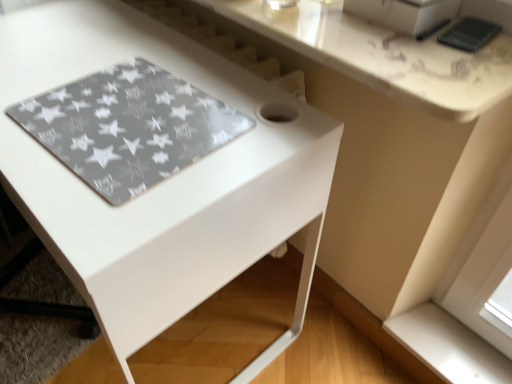
Locate an element on the screen. free location above transparent star-patterned mat at lower left (from a real-world perspective) is located at coordinates (131, 116).